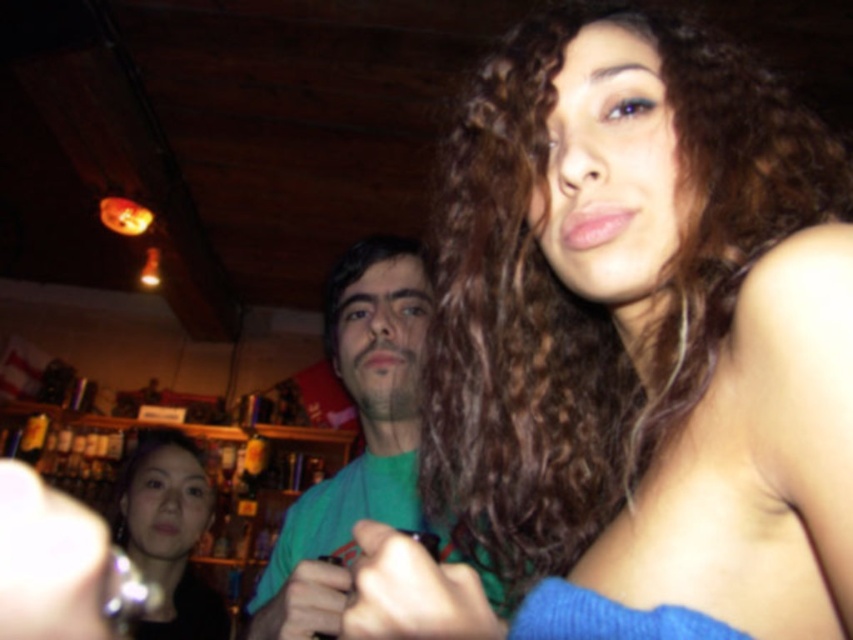
Question: Which object is farther from the camera taking this photo?

Choices:
 (A) matte green shirt at center
 (B) smooth skin face at lower left
 (C) green matte shirt at center

Answer: (B)

Question: Is blue fabric top at upper right above matte green hand at center?

Choices:
 (A) yes
 (B) no

Answer: (A)

Question: Which object appears closest to the camera in this image?

Choices:
 (A) matte green shirt at center
 (B) smooth black phone at center
 (C) matte green hand at center

Answer: (B)

Question: Does matte black phone at lower left appear on the left side of matte green shirt at center?

Choices:
 (A) no
 (B) yes

Answer: (B)

Question: Among these points, which one is nearest to the camera?

Choices:
 (A) (378, 534)
 (B) (396, 426)

Answer: (A)

Question: Does smooth skin face at lower left have a larger size compared to smooth black phone at center?

Choices:
 (A) yes
 (B) no

Answer: (A)